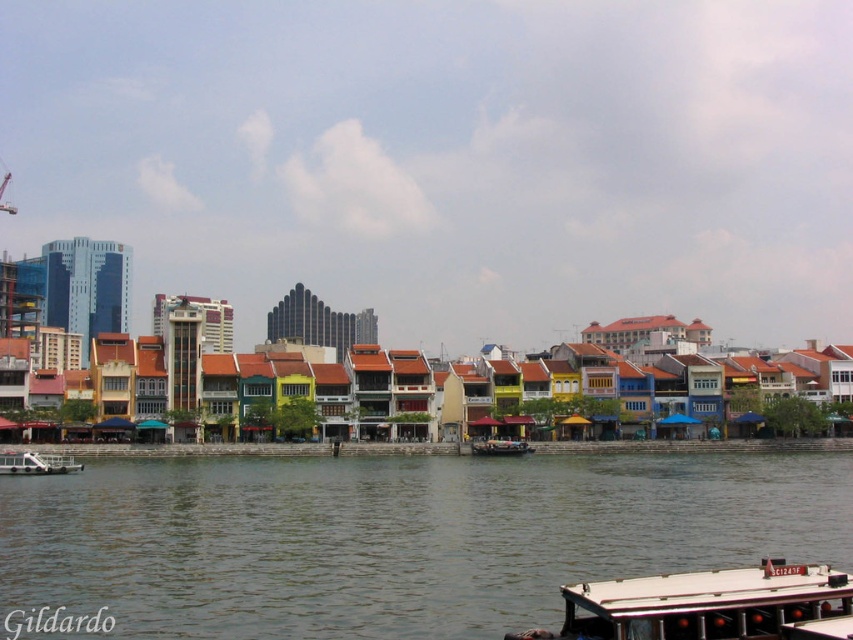
Question: Which point is closer to the camera?

Choices:
 (A) 49,460
 (B) 524,440
 (C) 401,522
 (D) 750,600

Answer: (D)

Question: Observing the image, what is the correct spatial positioning of greenish water at lower center in reference to white plastic boat at lower left?

Choices:
 (A) below
 (B) above

Answer: (A)

Question: Is the position of greenish water at lower center more distant than that of white glossy boat at center?

Choices:
 (A) no
 (B) yes

Answer: (A)

Question: Does white plastic boat at lower left have a larger size compared to white glossy boat at center?

Choices:
 (A) yes
 (B) no

Answer: (A)

Question: Which point appears farthest from the camera in this image?

Choices:
 (A) (503, 442)
 (B) (467, 486)
 (C) (51, 472)
 (D) (606, 605)

Answer: (A)

Question: Based on their relative distances, which object is farther from the greenish water at lower center?

Choices:
 (A) white glossy boat at center
 (B) white matte boat at lower right
 (C) white plastic boat at lower left

Answer: (C)